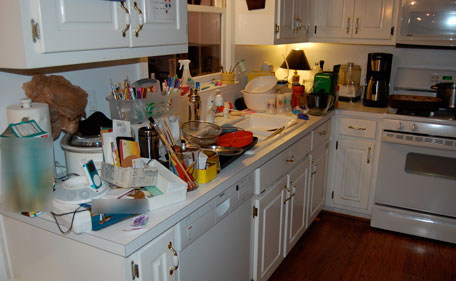
You are a GUI agent. You are given a task and a screenshot of the screen. Output one action in this format:
    pyautogui.click(x=<x>, y=<y>)
    Task: Click on the messy kitchen
    The image size is (456, 281).
    Given the screenshot: What is the action you would take?
    249,100